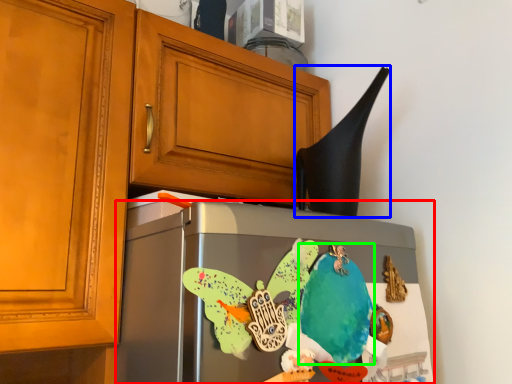
Question: Considering the real-world distances, which object is farthest from refrigerator (highlighted by a red box)? exhaust hood (highlighted by a blue box) or parrot (highlighted by a green box)?

Choices:
 (A) exhaust hood
 (B) parrot

Answer: (A)